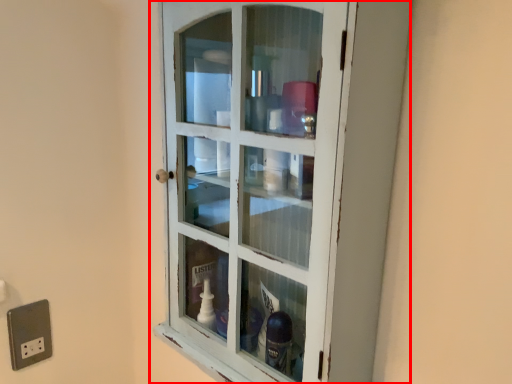
Question: Observing the image, what is the correct spatial positioning of cupboard (annotated by the red box) in reference to electric outlet?

Choices:
 (A) left
 (B) right

Answer: (B)